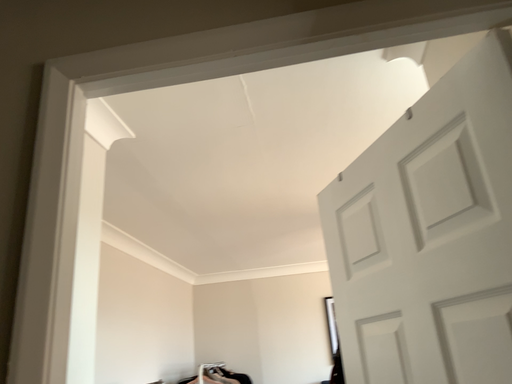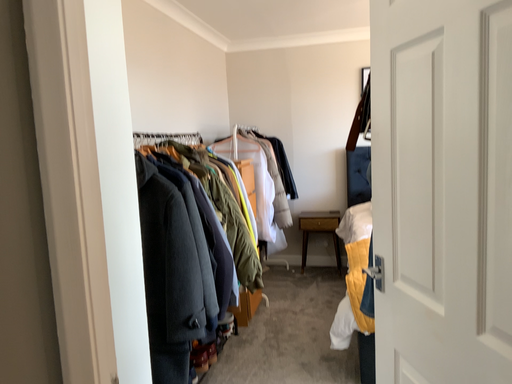
Question: How did the camera likely rotate when shooting the video?

Choices:
 (A) rotated downward
 (B) rotated upward

Answer: (A)